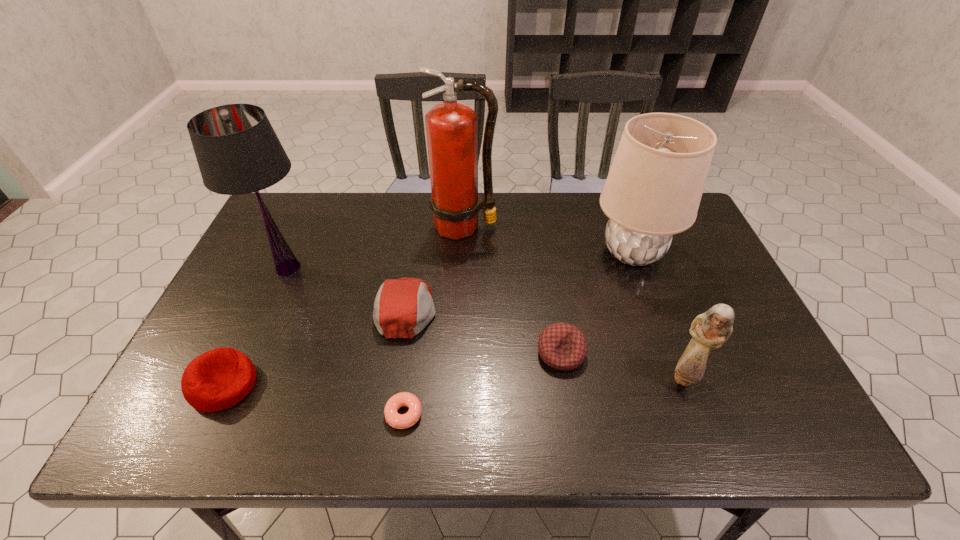
Find the location of a particular element. vacant space situated 0.110m at the nozzle of the fire extinguisher is located at coordinates (463, 268).

Find the location of a particular element. free region located 0.230m on the front-facing side of the left lampshade is located at coordinates click(402, 268).

Find the location of `vacant space situated on the front of the third tallest object`. vacant space situated on the front of the third tallest object is located at coordinates [649, 299].

This screenshot has width=960, height=540. I want to click on free space located on the front-facing side of the figurine, so click(x=703, y=428).

Image resolution: width=960 pixels, height=540 pixels. In order to click on vacant space positioned on the front-facing side of the cap in this screenshot , I will do (x=536, y=309).

The width and height of the screenshot is (960, 540). Identify the location of vacant space situated on the seat area of the taller beanbag. (313, 385).

Identify the location of vacant area located on the right of the right beanbag. The image size is (960, 540). (743, 353).

The image size is (960, 540). In order to click on vacant area situated 0.120m on the back of the doughnut in this screenshot , I will do `click(412, 353)`.

This screenshot has height=540, width=960. Identify the location of fire extinguisher at the far edge. (451, 128).

Find the location of a particular element. lampshade that is at the far edge is located at coordinates (653, 190).